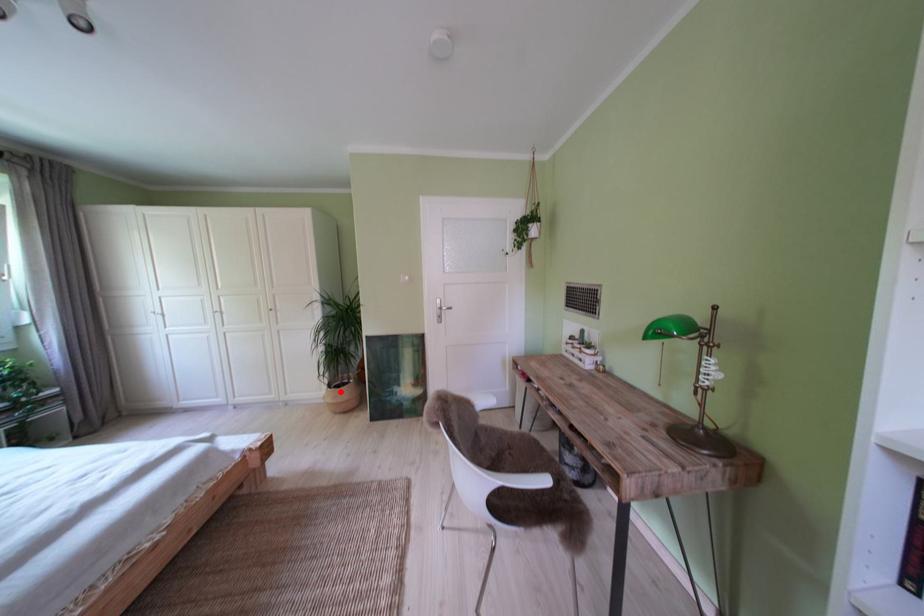
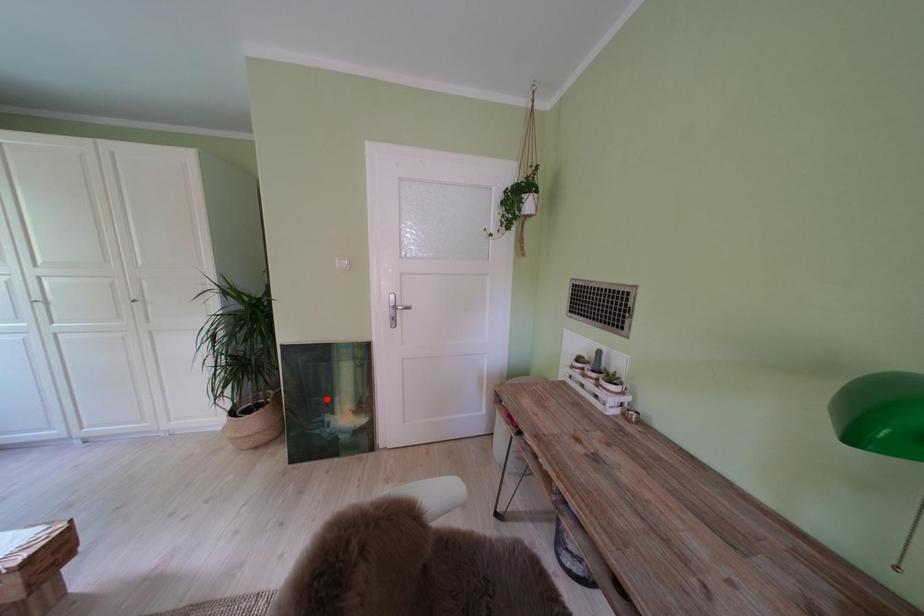
I am providing you with two images of the same scene from different viewpoints. A red point is marked on the first image and another point is marked on the second image. Is the marked point in image1 the same physical position as the marked point in image2?

No